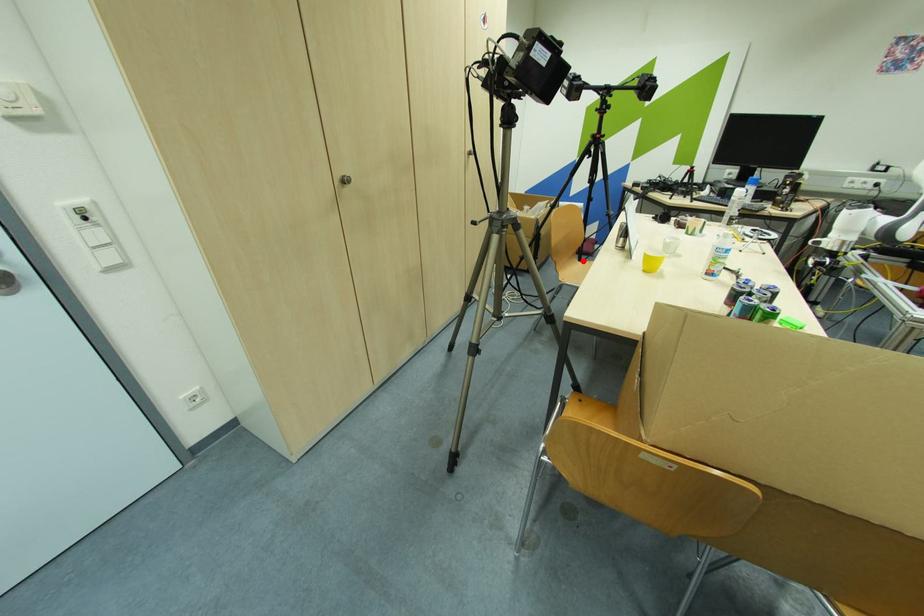
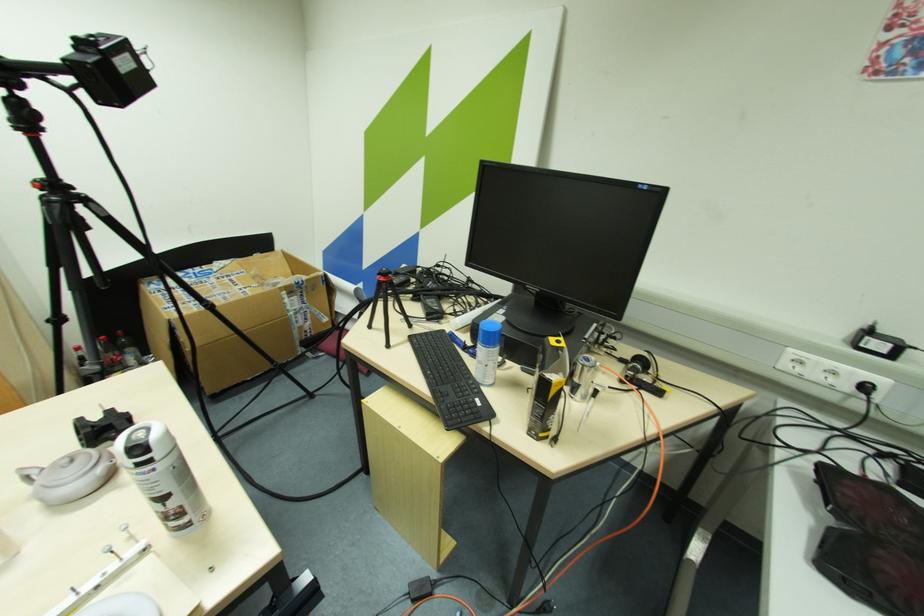
Question: I am providing you with two images of the same scene from different viewpoints. A red point is marked on the first image. Can you still see the location of the red point in image 2?

Choices:
 (A) Yes
 (B) No

Answer: (B)